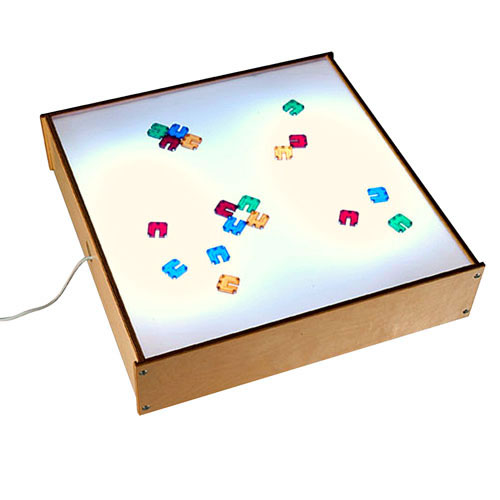
Find the location of a particular element. light box side is located at coordinates (358, 332), (117, 323).